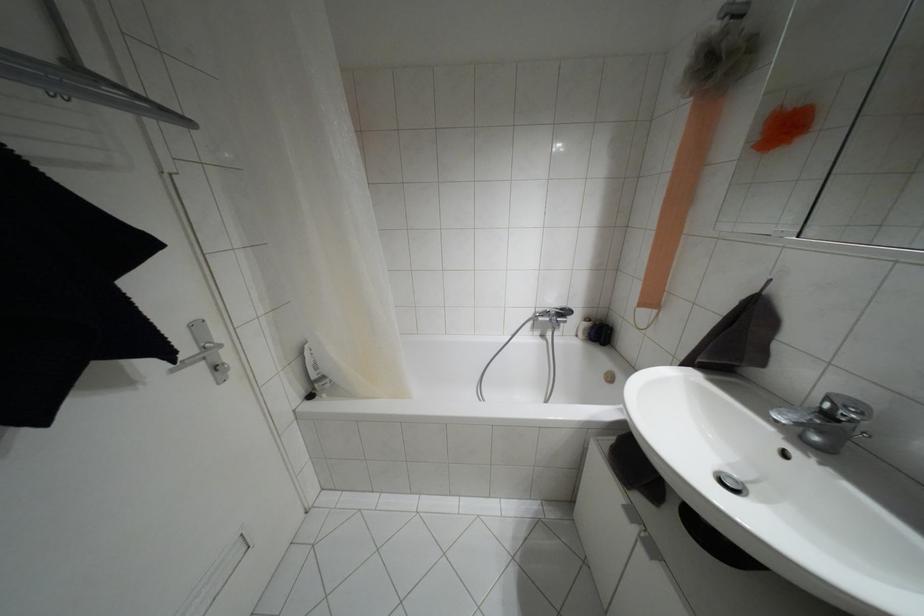
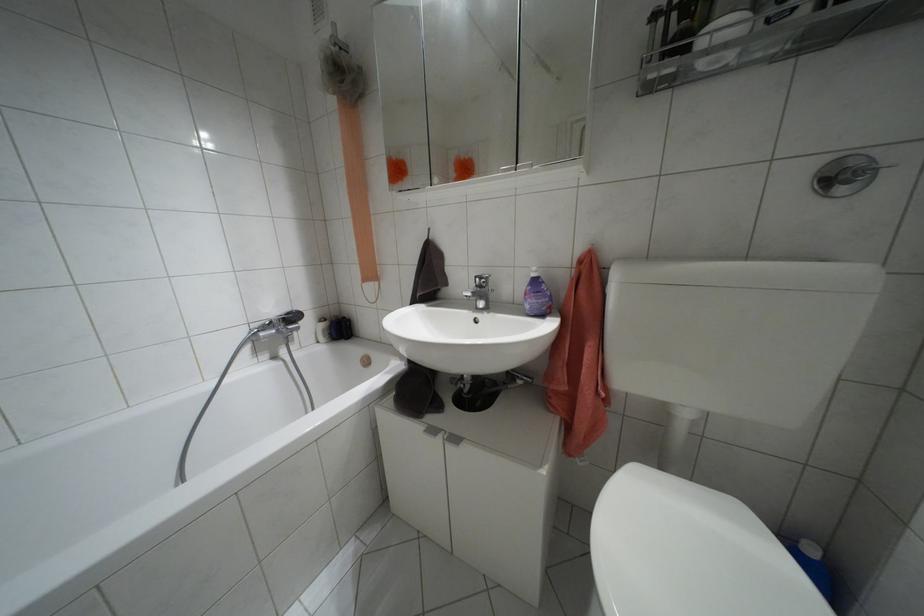
Find the pixel in the second image that matches pixel 651 549 in the first image.

(455, 439)